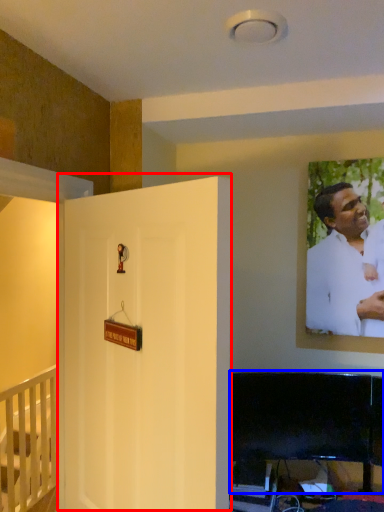
Question: Which of the following is the closest to the observer, door (highlighted by a red box) or furniture (highlighted by a blue box)?

Choices:
 (A) door
 (B) furniture

Answer: (A)